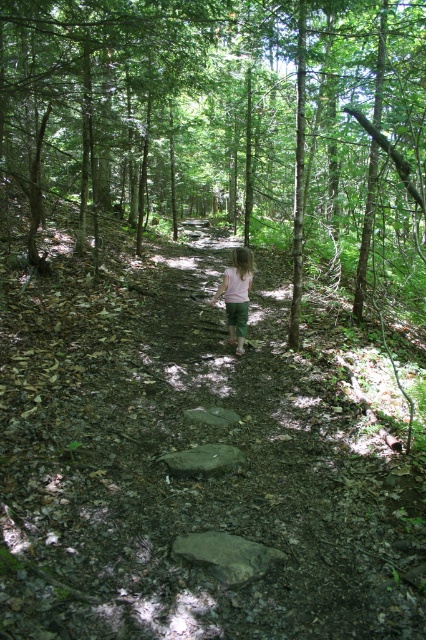
Question: Is white cotton shirt at center to the left of gray smooth rock at center from the viewer's perspective?

Choices:
 (A) yes
 (B) no

Answer: (B)

Question: Which of these objects is positioned farthest from the green leafy tree at center?

Choices:
 (A) white cotton shirt at center
 (B) gray smooth rock at center
 (C) gray rough rock at center

Answer: (B)

Question: Does green leafy tree at center appear on the left side of white cotton shirt at center?

Choices:
 (A) no
 (B) yes

Answer: (A)

Question: Is brown rough rock at center behind gray smooth rock at center?

Choices:
 (A) no
 (B) yes

Answer: (A)

Question: Which point is closer to the camera?

Choices:
 (A) brown rough rock at center
 (B) white cotton shirt at center

Answer: (A)

Question: Which point is closer to the camera?

Choices:
 (A) (221, 554)
 (B) (241, 259)

Answer: (A)